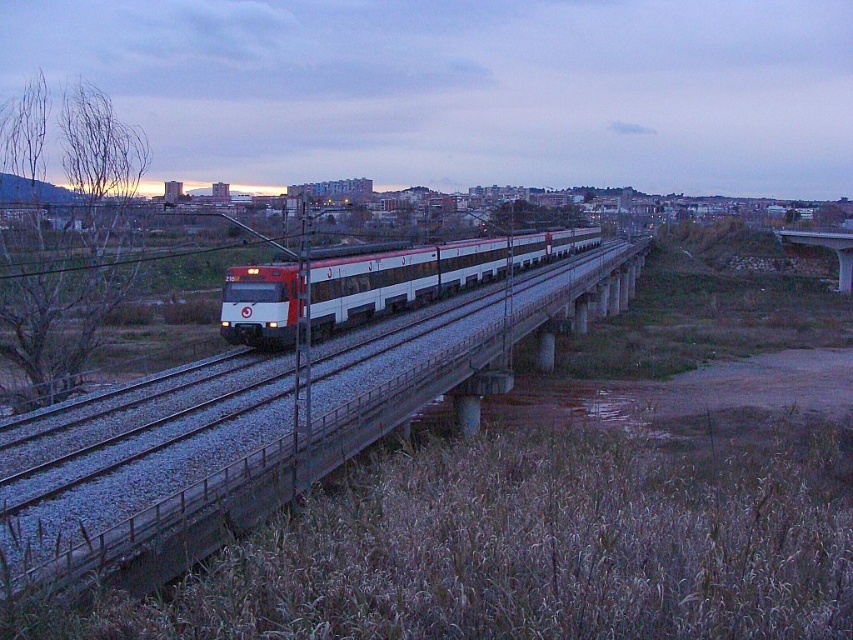
Question: Does white glossy passenger train at center appear on the right side of concrete bridge at right?

Choices:
 (A) yes
 (B) no

Answer: (B)

Question: Is white glossy passenger train at center below concrete bridge at right?

Choices:
 (A) no
 (B) yes

Answer: (B)

Question: Where is white glossy passenger train at center located in relation to concrete bridge at right in the image?

Choices:
 (A) right
 (B) left

Answer: (B)

Question: Which object is closer to the camera taking this photo?

Choices:
 (A) concrete bridge at right
 (B) white glossy passenger train at center

Answer: (B)

Question: Which point is farther to the camera?

Choices:
 (A) (782, 243)
 (B) (247, 275)

Answer: (A)

Question: Which point is farther from the camera taking this photo?

Choices:
 (A) (260, 280)
 (B) (778, 230)

Answer: (B)